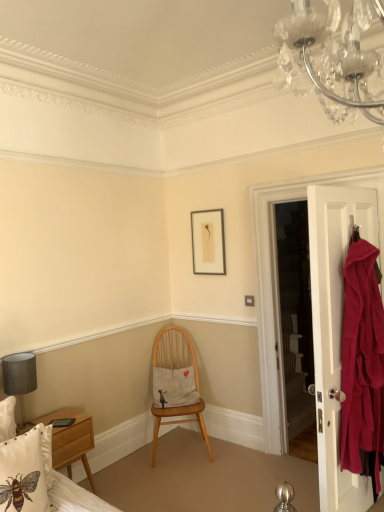
Question: Is matte white door at right not close to wooden chair at center?

Choices:
 (A) yes
 (B) no

Answer: (A)

Question: Considering the relative sizes of matte white door at right and wooden chair at center in the image provided, is matte white door at right taller than wooden chair at center?

Choices:
 (A) yes
 (B) no

Answer: (A)

Question: Is matte white door at right smaller than wooden chair at center?

Choices:
 (A) yes
 (B) no

Answer: (A)

Question: Can you confirm if matte white door at right is positioned to the left of wooden chair at center?

Choices:
 (A) yes
 (B) no

Answer: (B)

Question: Does matte white door at right turn towards wooden chair at center?

Choices:
 (A) yes
 (B) no

Answer: (A)

Question: Can we say matte white door at right lies outside wooden chair at center?

Choices:
 (A) no
 (B) yes

Answer: (B)

Question: Is matte white door at right turned away from white cotton pillow with bee design at lower left, which is counted as the second pillow, starting from the back?

Choices:
 (A) yes
 (B) no

Answer: (B)

Question: Is matte white door at right far from white cotton pillow with bee design at lower left, which appears as the 2th pillow when viewed from the right?

Choices:
 (A) yes
 (B) no

Answer: (A)

Question: Is matte white door at right wider than white cotton pillow with bee design at lower left, which is counted as the first pillow, starting from the left?

Choices:
 (A) no
 (B) yes

Answer: (A)

Question: Does matte white door at right appear on the left side of white cotton pillow with bee design at lower left, which is counted as the second pillow, starting from the back?

Choices:
 (A) yes
 (B) no

Answer: (B)

Question: Considering the relative sizes of matte white door at right and white cotton pillow with bee design at lower left, which is counted as the first pillow, starting from the left, in the image provided, is matte white door at right taller than white cotton pillow with bee design at lower left, which is counted as the first pillow, starting from the left,?

Choices:
 (A) no
 (B) yes

Answer: (B)

Question: Does matte white door at right have a lesser height compared to white cotton pillow with bee design at lower left, the first pillow when ordered from front to back?

Choices:
 (A) no
 (B) yes

Answer: (A)

Question: Could you tell me if matte gray lampshade at left is turned towards wooden chair at center?

Choices:
 (A) yes
 (B) no

Answer: (B)